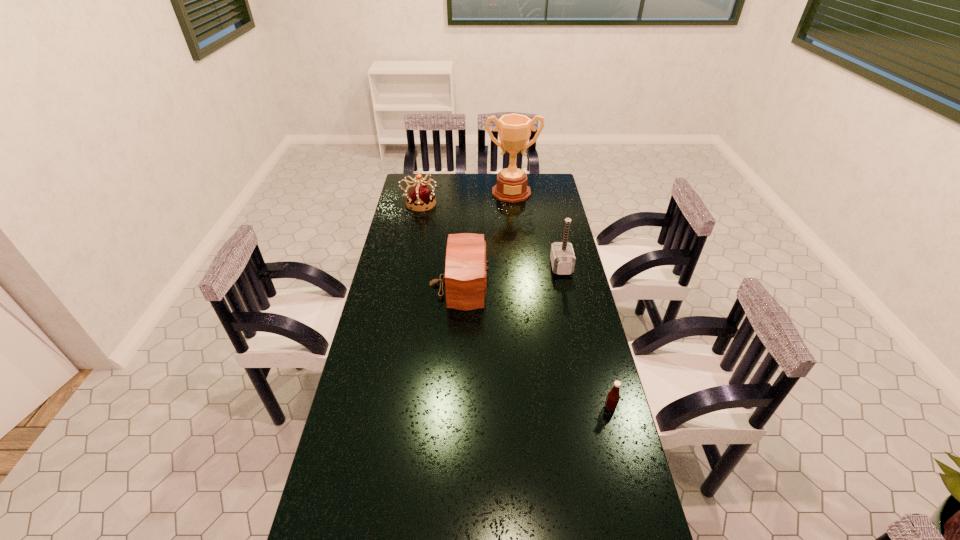
Locate an element on the screen. The image size is (960, 540). award is located at coordinates (514, 130).

You are a GUI agent. You are given a task and a screenshot of the screen. Output one action in this format:
    pyautogui.click(x=<x>, y=<y>)
    Task: Click on the second tallest object
    
    Given the screenshot: What is the action you would take?
    pyautogui.click(x=562, y=256)

Image resolution: width=960 pixels, height=540 pixels. Identify the location of tiara. (420, 197).

At what (x,y) coordinates should I click in order to perform the action: click on radio receiver. Please return your answer as a coordinate pair (x, y). Looking at the image, I should click on (465, 268).

Locate an element on the screen. This screenshot has width=960, height=540. the shortest object is located at coordinates (613, 396).

Locate an element on the screen. The height and width of the screenshot is (540, 960). the nearest object is located at coordinates click(x=613, y=396).

The image size is (960, 540). I want to click on vacant position located on the front-facing side of the award, so click(x=514, y=213).

Find the location of a particular element. free space located 0.190m for striking with the head of the hammer is located at coordinates (506, 267).

Identify the location of vacant space located for striking with the head of the hammer. The height and width of the screenshot is (540, 960). (487, 267).

You are a GUI agent. You are given a task and a screenshot of the screen. Output one action in this format:
    pyautogui.click(x=<x>, y=<y>)
    Task: Click on the vacant area located 0.350m for striking with the head of the hammer
    The height and width of the screenshot is (540, 960).
    Given the screenshot: What is the action you would take?
    pyautogui.click(x=467, y=267)